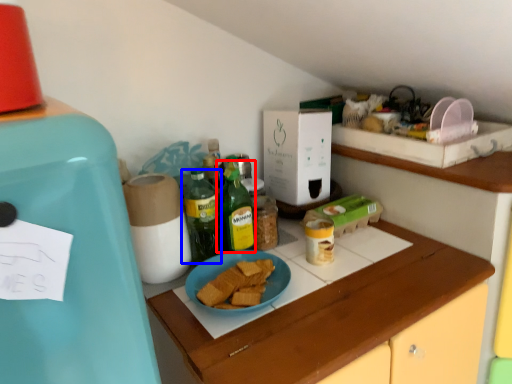
Question: Which point is closer to the camera, bottle (highlighted by a red box) or bottle (highlighted by a blue box)?

Choices:
 (A) bottle
 (B) bottle

Answer: (B)